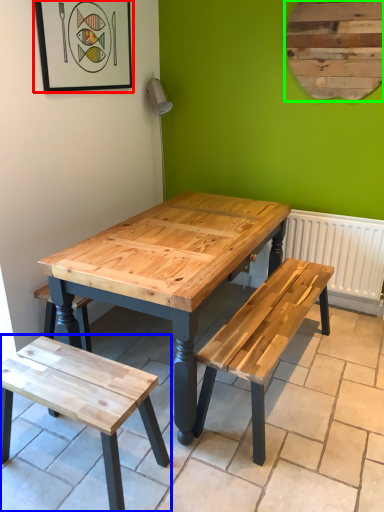
Question: Based on their relative distances, which object is nearer to picture frame (highlighted by a red box)? Choose from bench (highlighted by a blue box) and bulletin board (highlighted by a green box).

Choices:
 (A) bench
 (B) bulletin board

Answer: (B)